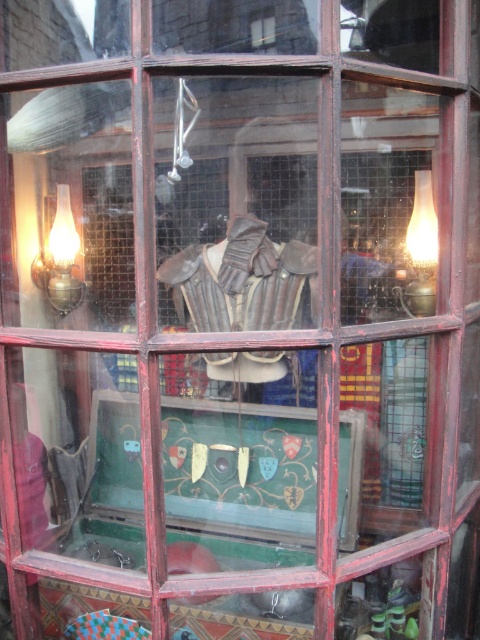
Question: Can you confirm if matte brass lamp at left is positioned below matte glass lamp at right?

Choices:
 (A) no
 (B) yes

Answer: (A)

Question: Does matte brass lamp at left appear over matte glass lamp at right?

Choices:
 (A) yes
 (B) no

Answer: (A)

Question: Among these points, which one is farthest from the camera?

Choices:
 (A) (422, 262)
 (B) (68, 291)

Answer: (B)

Question: Can you confirm if matte brass lamp at left is positioned to the left of matte glass lamp at right?

Choices:
 (A) yes
 (B) no

Answer: (A)